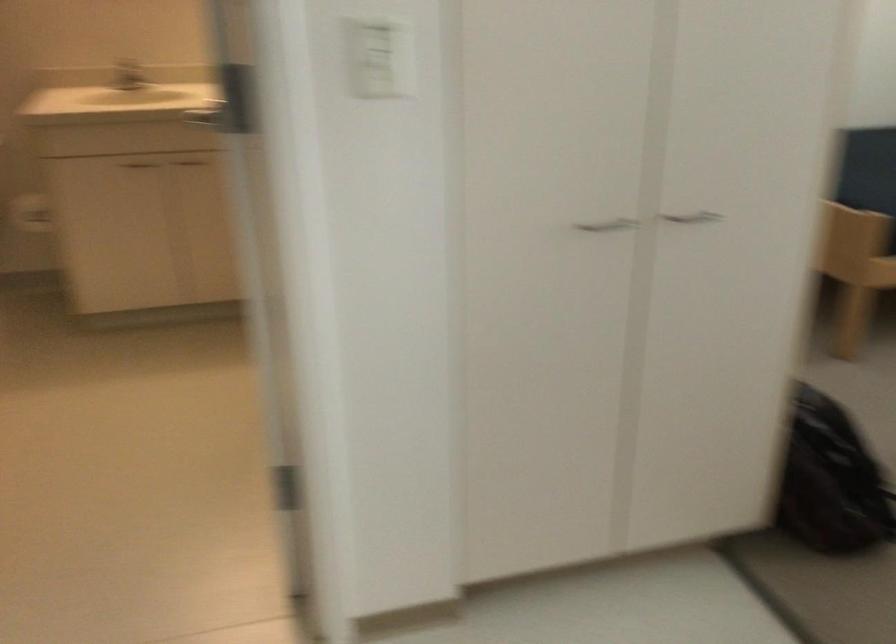
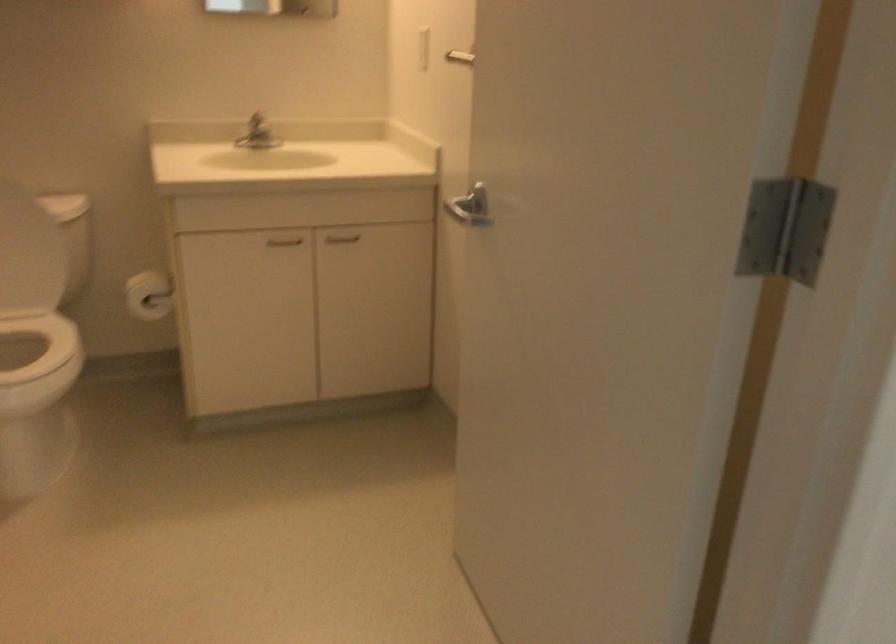
Question: Based on the continuous images, in which direction is the camera rotating? Reply with the corresponding letter.

Choices:
 (A) Left
 (B) Right
 (C) Up
 (D) Down

Answer: (B)